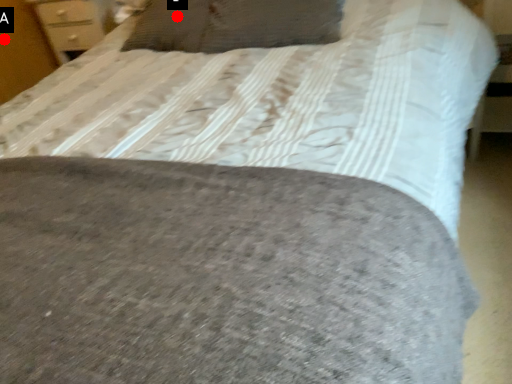
Question: Two points are circled on the image, labeled by A and B beside each circle. Among these points, which one is nearest to the camera?

Choices:
 (A) A is closer
 (B) B is closer

Answer: (B)